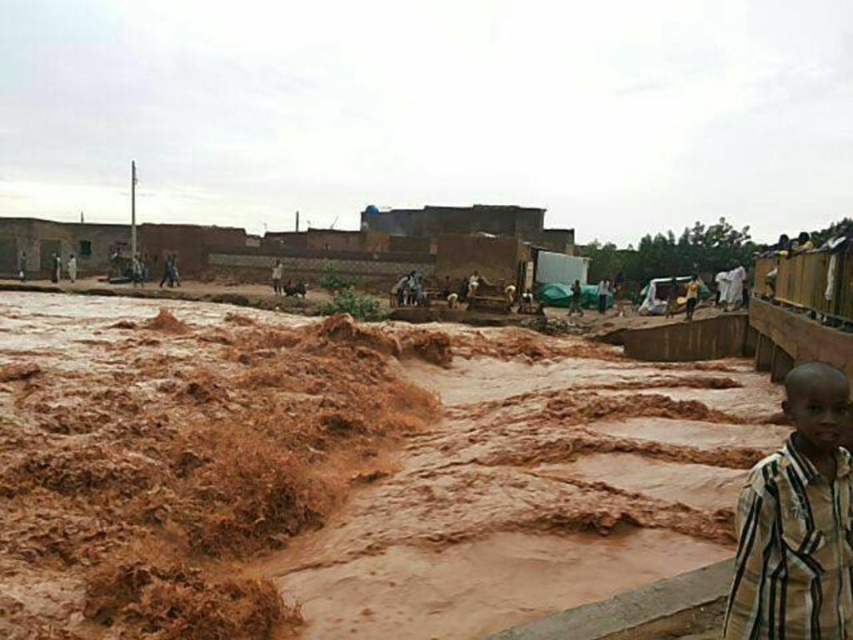
You are a rescue worker trying to reach the striped fabric boy at lower right from the brown muddy water at lower left. Considering the height difference between them, which direction should you move to avoid the rising water?

The brown muddy water at lower left has a greater height compared to striped fabric boy at lower right. To avoid the rising water, you should move towards higher ground away from the brown muddy water at lower left towards the striped fabric boy at lower right.

In the scene shown: You are standing in the flooded area and need to reach a safe point. There is a point at coordinates point (341, 548) that is 20.37 feet away. Can you safely walk to this point if your walking distance is limited to 20 feet?

The point at coordinates point (341, 548) is 20.37 feet away from you, which exceeds your walking distance limit of 20 feet. Therefore, you cannot safely walk to this point.